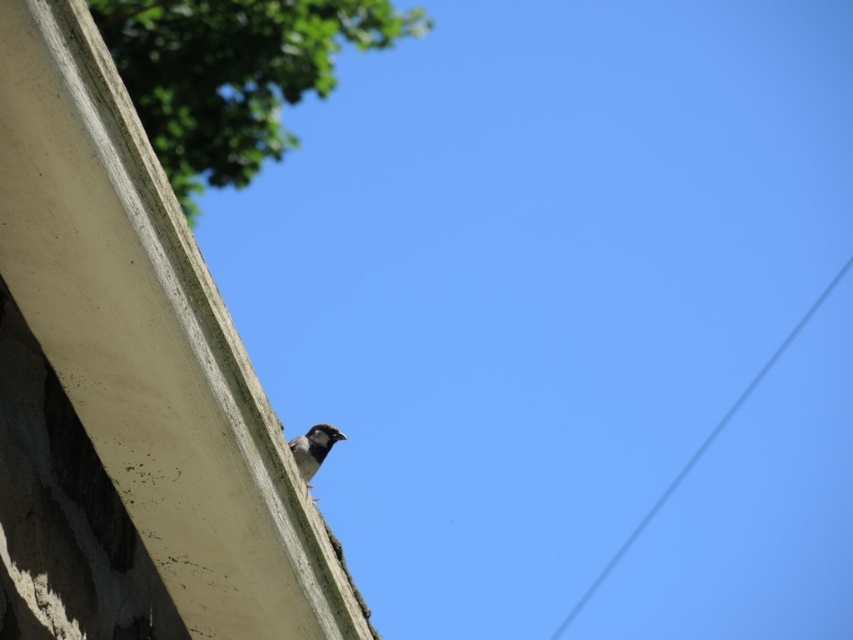
Does point (775, 353) come farther from viewer compared to point (306, 445)?

Yes, point (775, 353) is farther from viewer.

Is point (689, 460) positioned before point (297, 436)?

No, it is not.

Measure the distance between point (666,499) and camera.

A distance of 37.42 feet exists between point (666,499) and camera.

You are a GUI agent. You are given a task and a screenshot of the screen. Output one action in this format:
    pyautogui.click(x=<x>, y=<y>)
    Task: Click on the gray wire at upper right
    The image size is (853, 640).
    Given the screenshot: What is the action you would take?
    pyautogui.click(x=698, y=452)

The width and height of the screenshot is (853, 640). I want to click on green leafy tree at upper left, so click(x=233, y=74).

Between point (247, 8) and point (730, 413), which one is positioned in front?

Point (247, 8) is more forward.

You are a GUI agent. You are given a task and a screenshot of the screen. Output one action in this format:
    pyautogui.click(x=<x>, y=<y>)
    Task: Click on the green leafy tree at upper left
    
    Given the screenshot: What is the action you would take?
    pyautogui.click(x=233, y=74)

Measure the distance between green leafy tree at upper left and camera.

9.31 meters

Who is higher up, green leafy tree at upper left or dark gray matte sparrow at upper center?

green leafy tree at upper left is higher up.

Between point (241, 173) and point (335, 438), which one is positioned in front?

Point (335, 438)

This screenshot has width=853, height=640. Find the location of `green leafy tree at upper left`. green leafy tree at upper left is located at coordinates (233, 74).